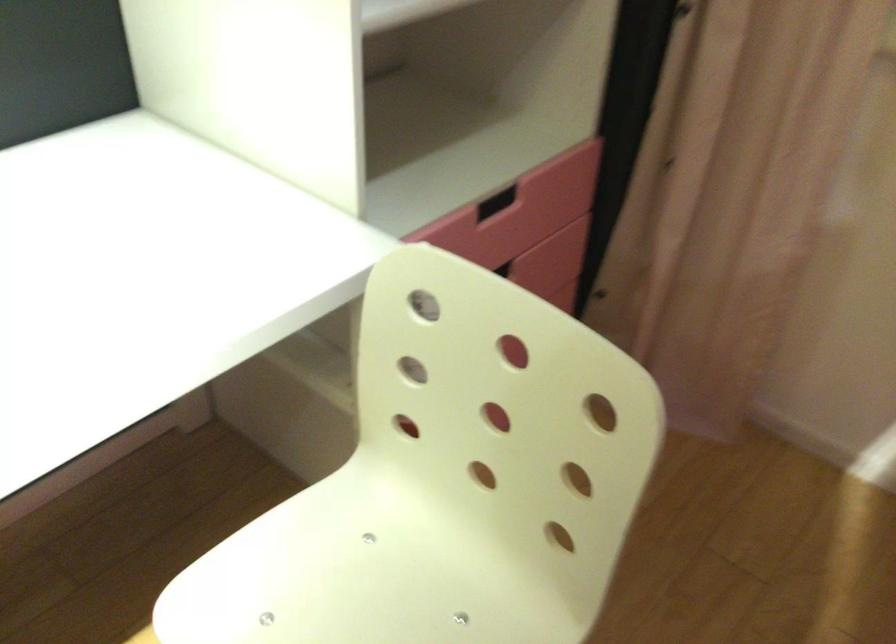
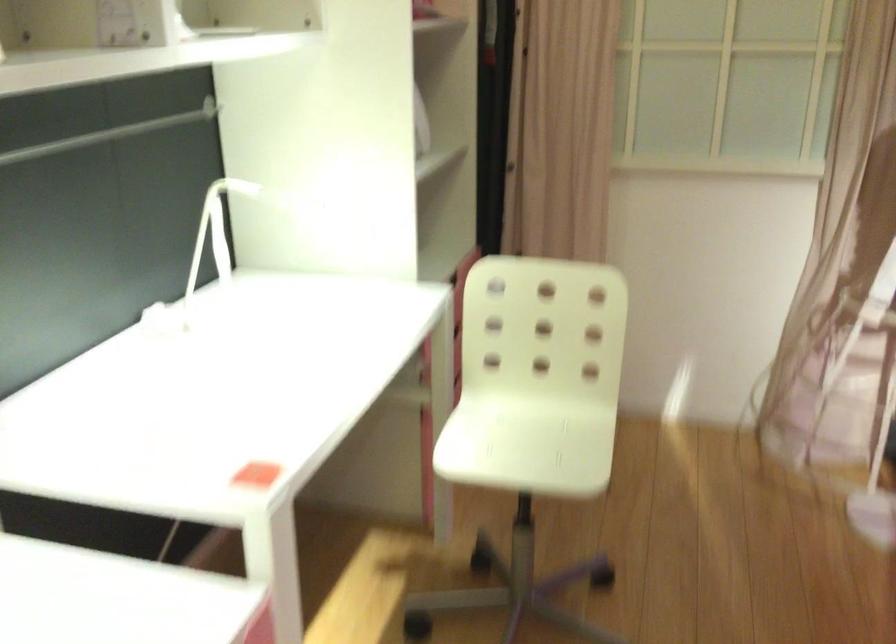
From the picture: In a continuous first-person perspective shot, in which direction is the camera moving?

The movement direction of the cameraman is left, backward.